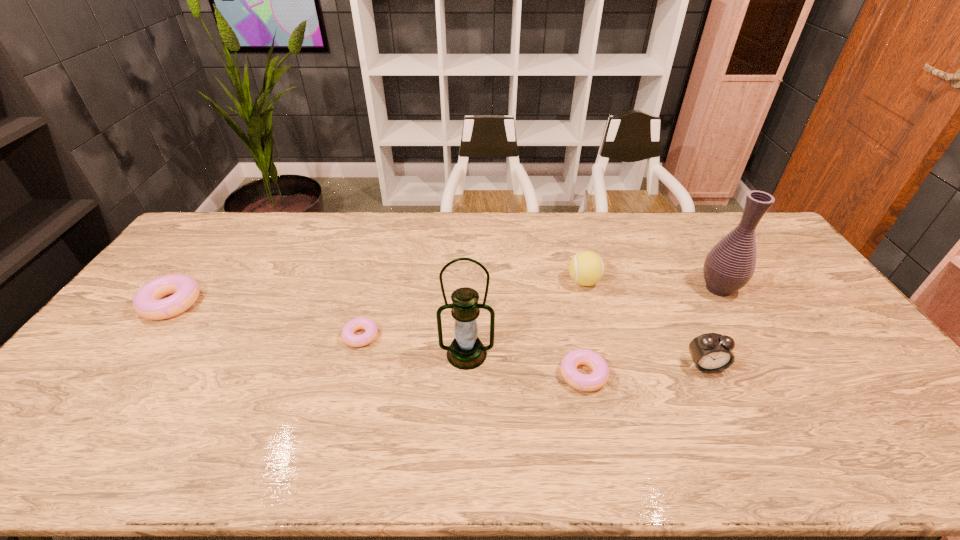
At what (x,y) coordinates should I click in order to perform the action: click on free space for a new doughnut on the right. Please return your answer as a coordinate pair (x, y). The height and width of the screenshot is (540, 960). Looking at the image, I should click on (848, 420).